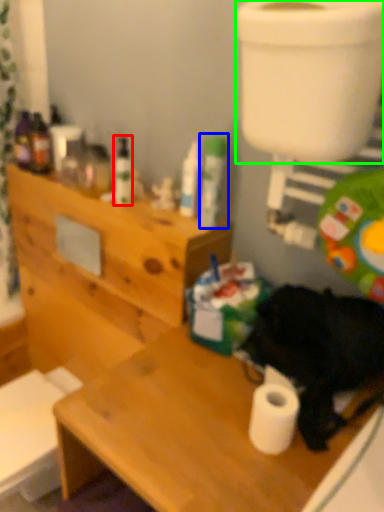
Question: Which object is the closest to the toiletry (highlighted by a red box)? Choose among these: toiletry (highlighted by a blue box) or toilet bowl (highlighted by a green box).

Choices:
 (A) toiletry
 (B) toilet bowl

Answer: (A)